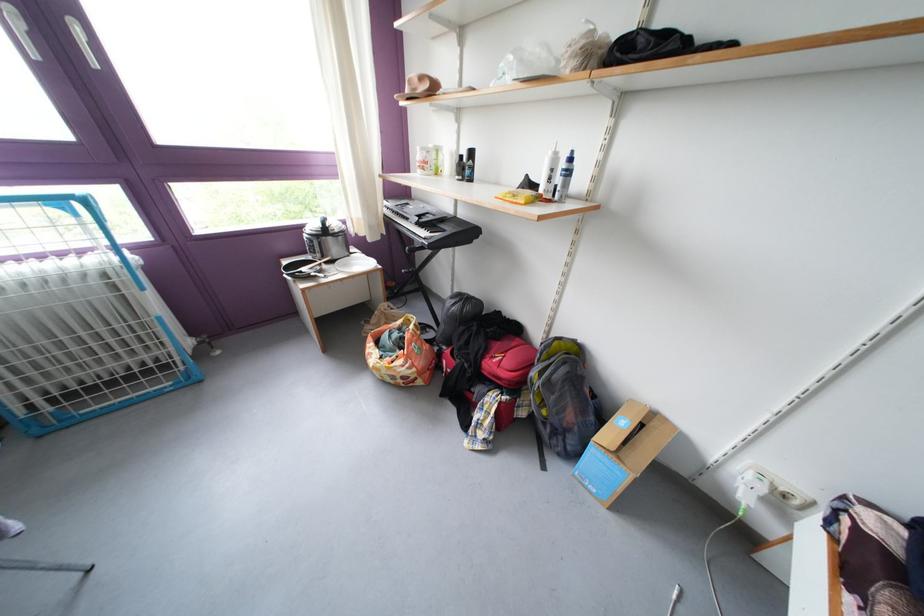
This screenshot has height=616, width=924. Identify the location of frying pan handle. (317, 267).